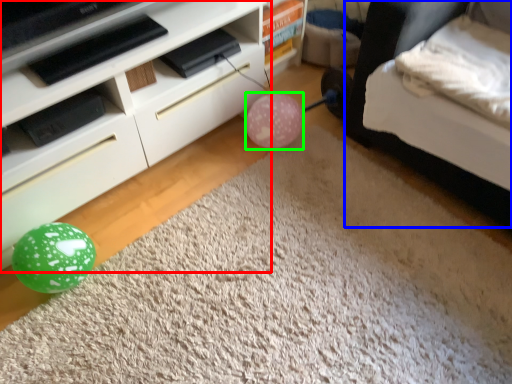
Question: Considering the real-world distances, which object is closest to furniture (highlighted by a red box)? bed (highlighted by a blue box) or balloon (highlighted by a green box).

Choices:
 (A) bed
 (B) balloon

Answer: (B)